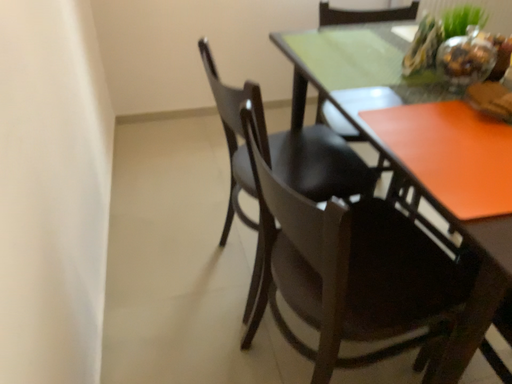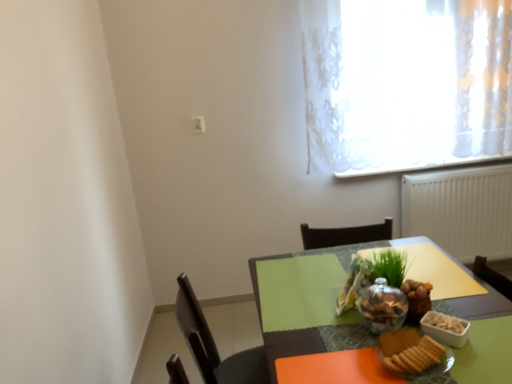
Question: Which way did the camera rotate in the video?

Choices:
 (A) rotated right
 (B) rotated left

Answer: (B)